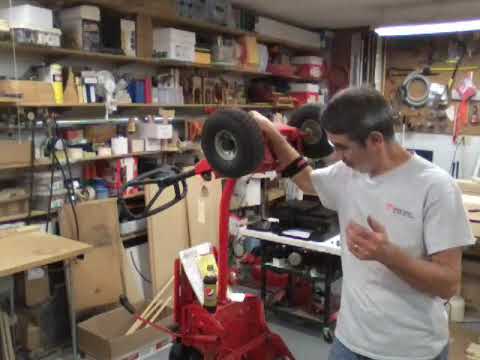
Identify the location of table. (38, 248).